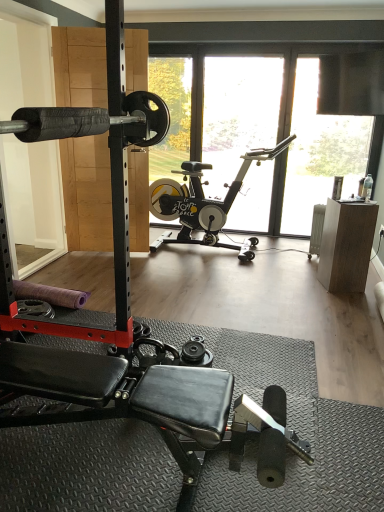
Question: Can you confirm if black rubber stationary bicycle at center is bigger than black rubber dumbbell at center?

Choices:
 (A) no
 (B) yes

Answer: (B)

Question: From the image's perspective, is black rubber stationary bicycle at center above black rubber dumbbell at center?

Choices:
 (A) no
 (B) yes

Answer: (B)

Question: Is black rubber stationary bicycle at center turned away from black rubber dumbbell at center?

Choices:
 (A) no
 (B) yes

Answer: (A)

Question: Is black rubber stationary bicycle at center not inside black rubber dumbbell at center?

Choices:
 (A) yes
 (B) no

Answer: (A)

Question: Are black rubber stationary bicycle at center and black rubber dumbbell at center located far from each other?

Choices:
 (A) no
 (B) yes

Answer: (B)

Question: Relative to transparent glass window at upper center, is black rubber dumbbell at center in front or behind?

Choices:
 (A) front
 (B) behind

Answer: (A)

Question: Is black rubber dumbbell at center to the left or to the right of transparent glass window at upper center in the image?

Choices:
 (A) right
 (B) left

Answer: (B)

Question: From the image's perspective, is black rubber dumbbell at center above or below transparent glass window at upper center?

Choices:
 (A) below
 (B) above

Answer: (A)

Question: Is black rubber dumbbell at center bigger or smaller than transparent glass window at upper center?

Choices:
 (A) small
 (B) big

Answer: (A)

Question: Based on their positions, is black rubber barbell at left located to the left or right of black rubber dumbbell at center?

Choices:
 (A) right
 (B) left

Answer: (B)

Question: From the image's perspective, is black rubber barbell at left positioned above or below black rubber dumbbell at center?

Choices:
 (A) above
 (B) below

Answer: (A)

Question: Does point (48, 216) appear closer or farther from the camera than point (208, 352)?

Choices:
 (A) closer
 (B) farther

Answer: (B)

Question: From a real-world perspective, is black rubber barbell at left above or below black rubber dumbbell at center?

Choices:
 (A) below
 (B) above

Answer: (B)

Question: Choose the correct answer: Is black rubber barbell at left inside black rubber stationary bicycle at center or outside it?

Choices:
 (A) outside
 (B) inside

Answer: (A)

Question: From the image's perspective, is black rubber barbell at left located above or below black rubber stationary bicycle at center?

Choices:
 (A) below
 (B) above

Answer: (B)